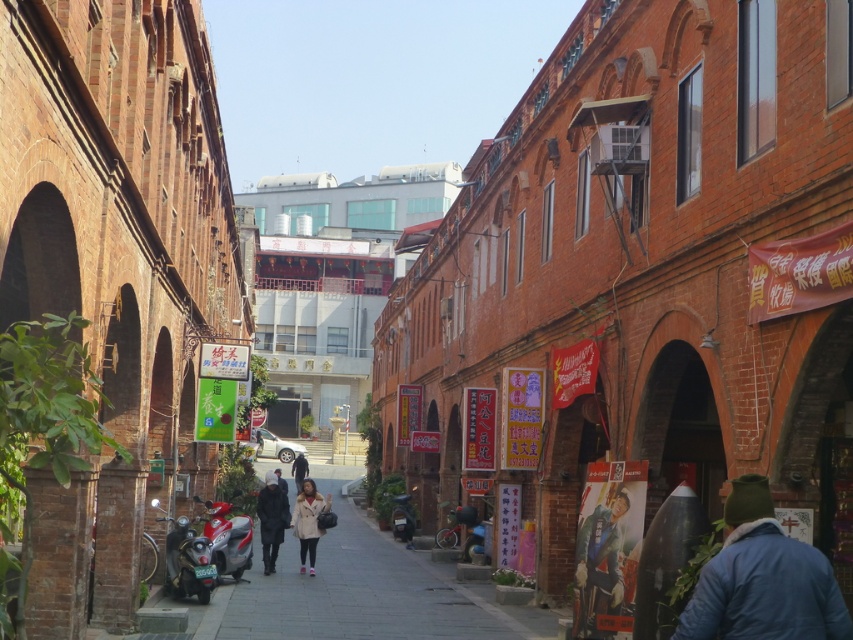
Between blue denim jacket at lower right and dark gray fabric jacket at center, which one is positioned lower?

dark gray fabric jacket at center

Who is more forward, (x=593, y=545) or (x=274, y=548)?

Point (x=593, y=545) is more forward.

In order to click on blue denim jacket at lower right in this screenshot , I will do `click(598, 563)`.

Does point (704, 600) come behind point (314, 515)?

No, (704, 600) is closer to viewer.

In order to click on blue fleece jacket at lower right in this screenshot , I will do `click(762, 579)`.

Is smooth concrete pavement at center taller than dark gray fabric jacket at center?

No.

Can you confirm if smooth concrete pavement at center is wider than dark gray fabric jacket at center?

Correct, the width of smooth concrete pavement at center exceeds that of dark gray fabric jacket at center.

At what (x,y) coordinates should I click in order to perform the action: click on smooth concrete pavement at center. Please return your answer as a coordinate pair (x, y). This screenshot has height=640, width=853. Looking at the image, I should click on (357, 593).